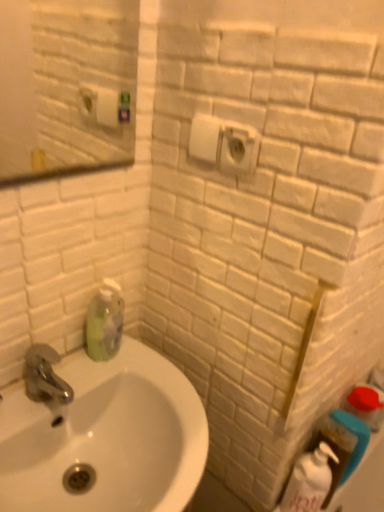
Image resolution: width=384 pixels, height=512 pixels. Find the location of `empty space that is to the right of green matte bottle at lower left, marked as the first cleaning product in a top-to-bottom arrangement`. empty space that is to the right of green matte bottle at lower left, marked as the first cleaning product in a top-to-bottom arrangement is located at coordinates (159, 376).